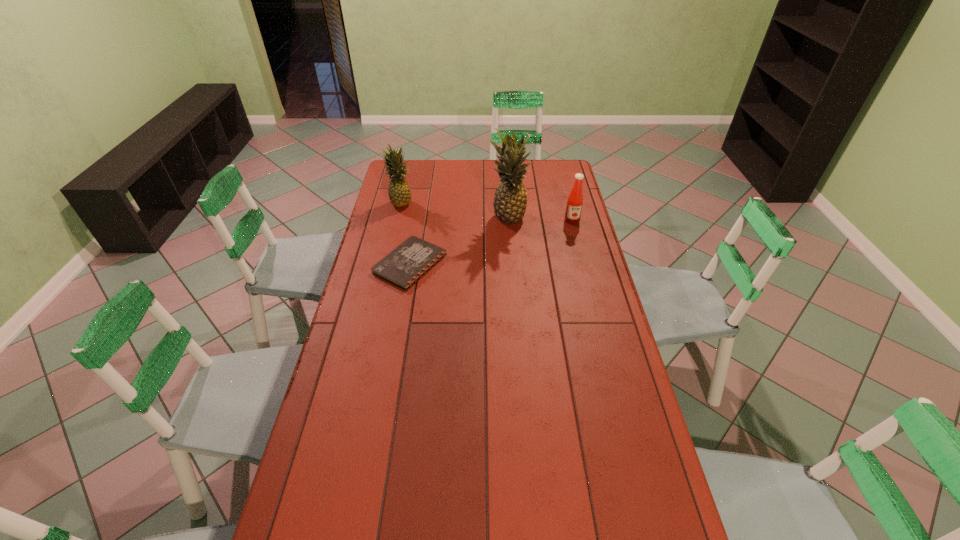
The height and width of the screenshot is (540, 960). I want to click on free spot between the condiment and the third shortest object, so click(486, 211).

Identify the location of empty location between the shortest object and the right pineapple. This screenshot has width=960, height=540. (459, 241).

I want to click on blank region between the right pineapple and the rightmost object, so click(540, 220).

This screenshot has width=960, height=540. In order to click on vacant space that is in between the notebook and the left pineapple in this screenshot , I will do `click(405, 233)`.

At what (x,y) coordinates should I click in order to perform the action: click on empty location between the second tallest object and the rightmost object. Please return your answer as a coordinate pair (x, y). The width and height of the screenshot is (960, 540). Looking at the image, I should click on (486, 211).

This screenshot has width=960, height=540. I want to click on free space that is in between the left pineapple and the second object from right to left, so click(x=454, y=211).

Find the location of a particular element. This screenshot has height=540, width=960. empty location between the third object from left to right and the shorter pineapple is located at coordinates (454, 211).

The image size is (960, 540). In order to click on vacant space in between the shortest object and the shorter pineapple in this screenshot , I will do coord(405,233).

Identify the location of free space between the right pineapple and the third tallest object. This screenshot has width=960, height=540. (540, 220).

You are a GUI agent. You are given a task and a screenshot of the screen. Output one action in this format:
    pyautogui.click(x=<x>, y=<y>)
    Task: Click on the free space between the third object from left to right and the shorter pineapple
    The height and width of the screenshot is (540, 960).
    Given the screenshot: What is the action you would take?
    pyautogui.click(x=454, y=211)